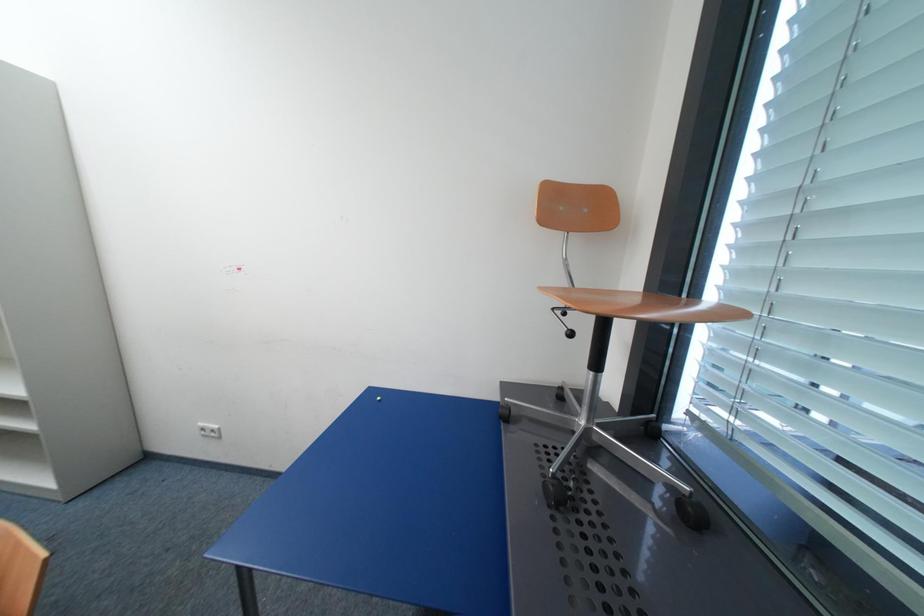
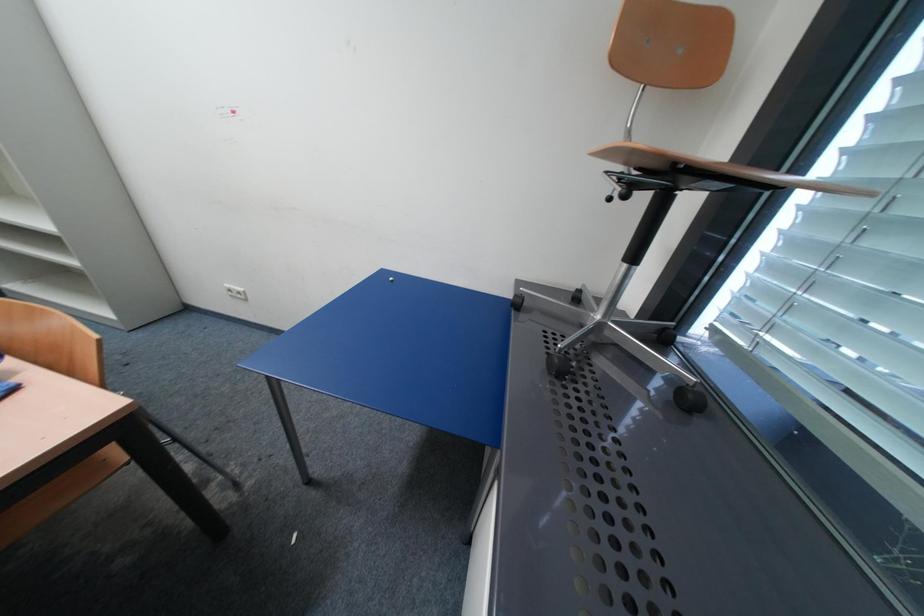
Question: What movement of the cameraman would produce the second image?

Choices:
 (A) Left
 (B) Right
 (C) Forward
 (D) Backward

Answer: (C)